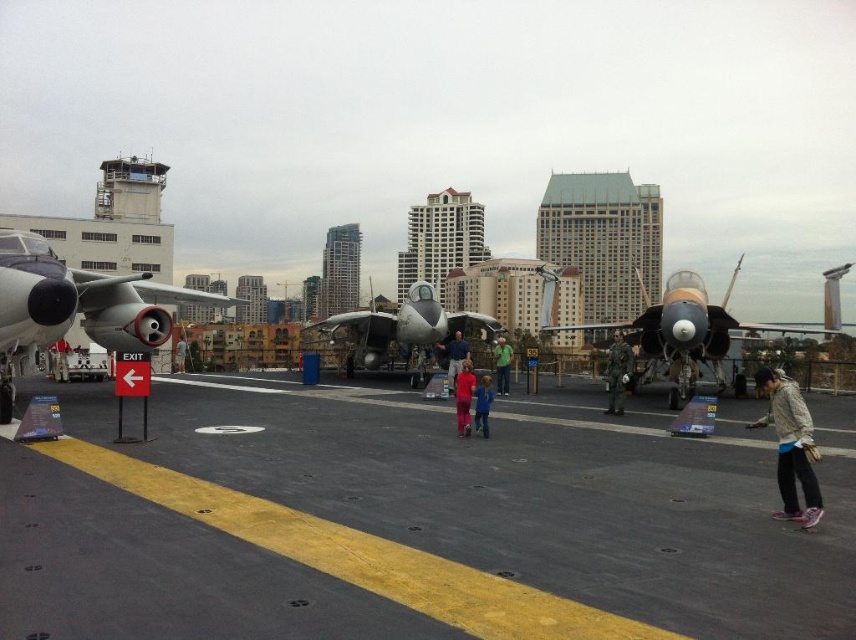
Between black asphalt tarmac at center and light gray hoodie at lower right, which one appears on the right side from the viewer's perspective?

Positioned to the right is light gray hoodie at lower right.

Is point (815, 593) closer to viewer compared to point (776, 400)?

That is True.

Which is behind, point (525, 532) or point (804, 486)?

The point (804, 486) is more distant.

Where is `black asphalt tarmac at center`? Image resolution: width=856 pixels, height=640 pixels. black asphalt tarmac at center is located at coordinates (412, 520).

Is metallic gray jet at center wider than green cotton shirt at center?

Yes.

Is metallic gray jet at center smaller than green cotton shirt at center?

Incorrect, metallic gray jet at center is not smaller in size than green cotton shirt at center.

Is point (384, 312) more distant than point (509, 364)?

Yes, it is behind point (509, 364).

The width and height of the screenshot is (856, 640). What are the coordinates of `metallic gray jet at center` in the screenshot? It's located at (403, 328).

How far apart are camouflage paint fighter jet at center and matte gray fighter jet at center?

camouflage paint fighter jet at center and matte gray fighter jet at center are 133.78 feet apart.

The width and height of the screenshot is (856, 640). What do you see at coordinates (676, 332) in the screenshot?
I see `camouflage paint fighter jet at center` at bounding box center [676, 332].

Does point (712, 308) come closer to viewer compared to point (455, 369)?

Yes, it is.

I want to click on camouflage paint fighter jet at center, so click(676, 332).